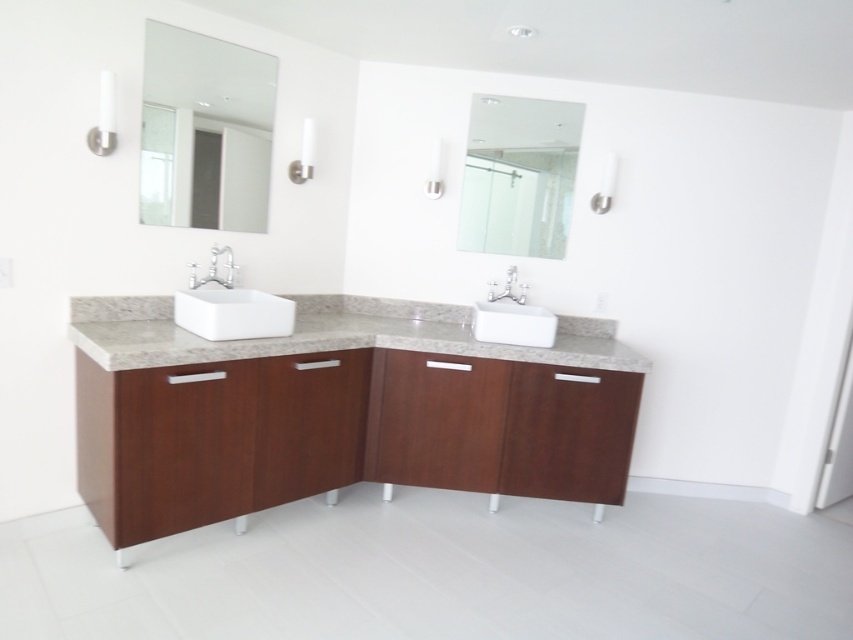
Question: Which point appears farthest from the camera in this image?

Choices:
 (A) (254, 176)
 (B) (508, 285)
 (C) (206, 300)
 (D) (509, 278)

Answer: (B)

Question: Does white ceramic sink at left appear on the left side of satin nickel faucet at center?

Choices:
 (A) no
 (B) yes

Answer: (B)

Question: Does gray granite countertop at center appear on the right side of white ceramic faucet at center?

Choices:
 (A) no
 (B) yes

Answer: (A)

Question: Which of the following is the farthest from the observer?

Choices:
 (A) white ceramic faucet at center
 (B) white ceramic sink at left
 (C) satin nickel faucet at center
 (D) clear glass mirror at upper center

Answer: (C)

Question: Which point is farther from the camera taking this photo?

Choices:
 (A) (514, 266)
 (B) (199, 84)

Answer: (A)

Question: Is clear glass mirror at upper center further to camera compared to satin nickel faucet at center?

Choices:
 (A) yes
 (B) no

Answer: (B)